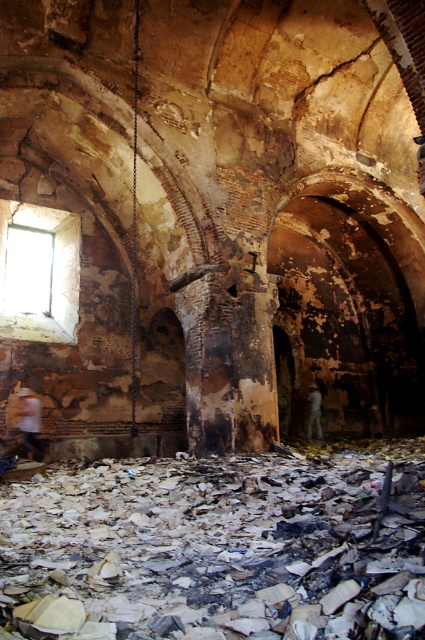
Who is higher up, burnt paper at center or denim jacket at lower right?

burnt paper at center is higher up.

Is burnt paper at center below denim jacket at lower right?

No.

Image resolution: width=425 pixels, height=640 pixels. In order to click on burnt paper at center in this screenshot , I will do `click(223, 545)`.

Where is `burnt paper at center`? The image size is (425, 640). burnt paper at center is located at coordinates 223,545.

Who is lower down, burnt paper at center or transparent glass window at upper left?

burnt paper at center is below.

How distant is burnt paper at center from transparent glass window at upper left?

The distance of burnt paper at center from transparent glass window at upper left is 7.34 meters.

Measure the distance between point [37,525] and camera.

They are 5.94 meters apart.

You are a GUI agent. You are given a task and a screenshot of the screen. Output one action in this format:
    pyautogui.click(x=<x>, y=<y>)
    Task: Click on the burnt paper at center
    The height and width of the screenshot is (640, 425).
    Given the screenshot: What is the action you would take?
    coord(223,545)

Does burnt paper at center have a larger size compared to white matte shirt at lower left?

Indeed, burnt paper at center has a larger size compared to white matte shirt at lower left.

Is burnt paper at center to the right of white matte shirt at lower left from the viewer's perspective?

Yes, burnt paper at center is to the right of white matte shirt at lower left.

Between point (226, 541) and point (27, 436), which one is positioned behind?

The point (27, 436) is behind.

The height and width of the screenshot is (640, 425). What are the coordinates of `burnt paper at center` in the screenshot? It's located at (223, 545).